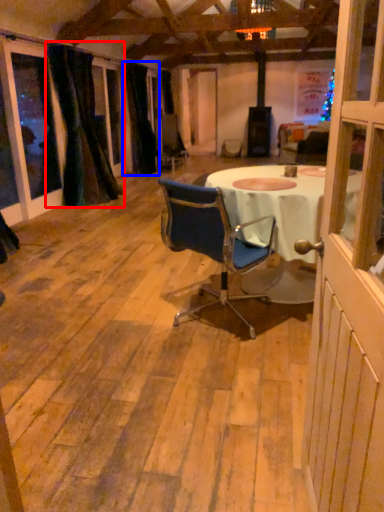
Question: Among these objects, which one is farthest to the camera, curtain (highlighted by a red box) or curtain (highlighted by a blue box)?

Choices:
 (A) curtain
 (B) curtain

Answer: (B)